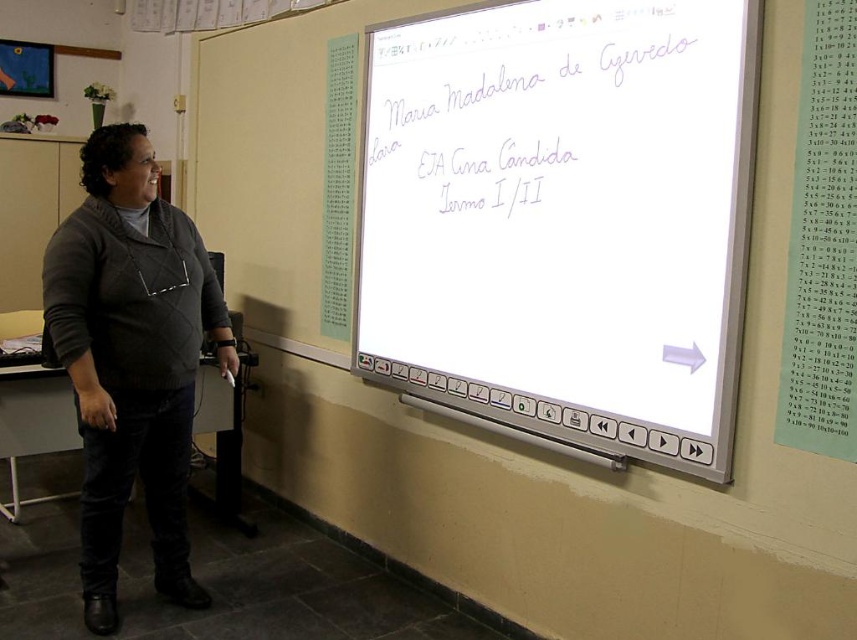
Consider the image. Who is higher up, white glossy screen at upper center or dark gray sweater at left?

white glossy screen at upper center is above.

Is white glossy screen at upper center taller than dark gray sweater at left?

In fact, white glossy screen at upper center may be shorter than dark gray sweater at left.

Is point (603, 148) farther from camera compared to point (159, 506)?

That is False.

Where is `white glossy screen at upper center`? This screenshot has width=857, height=640. white glossy screen at upper center is located at coordinates (562, 221).